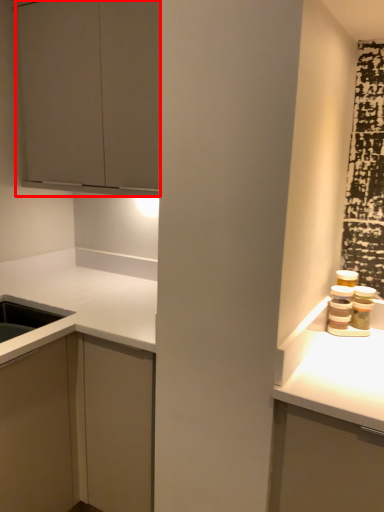
Question: From the image, what is the correct spatial relationship of cabinetry (annotated by the red box) in relation to cabinetry?

Choices:
 (A) left
 (B) right

Answer: (B)